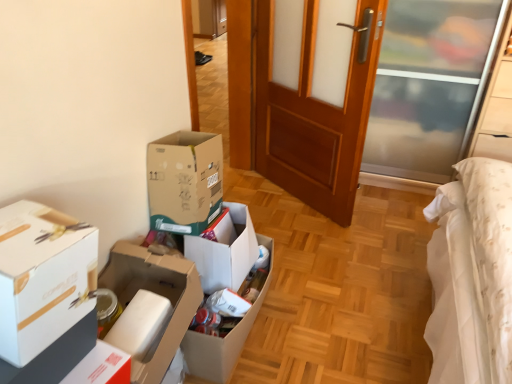
The width and height of the screenshot is (512, 384). In order to click on free spot above white cardboard box at center, positioned as the 2th box in back-to-front order (from a real-world perspective) in this screenshot , I will do `click(141, 310)`.